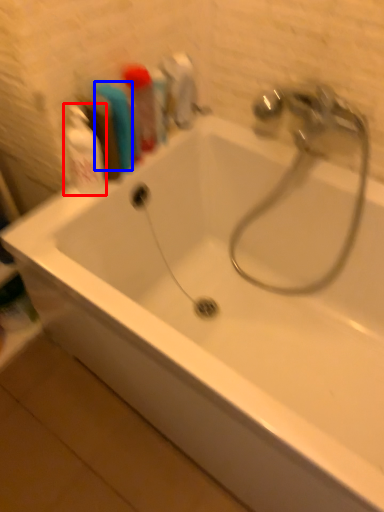
Question: Which of the following is the farthest to the observer, cleaning product (highlighted by a red box) or toiletry (highlighted by a blue box)?

Choices:
 (A) cleaning product
 (B) toiletry

Answer: (B)